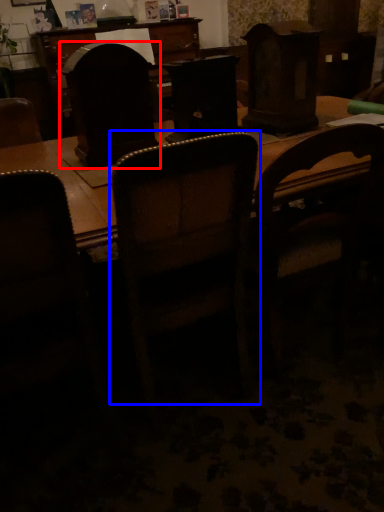
Question: Among these objects, which one is farthest to the camera, swivel chair (highlighted by a red box) or chair (highlighted by a blue box)?

Choices:
 (A) swivel chair
 (B) chair

Answer: (A)